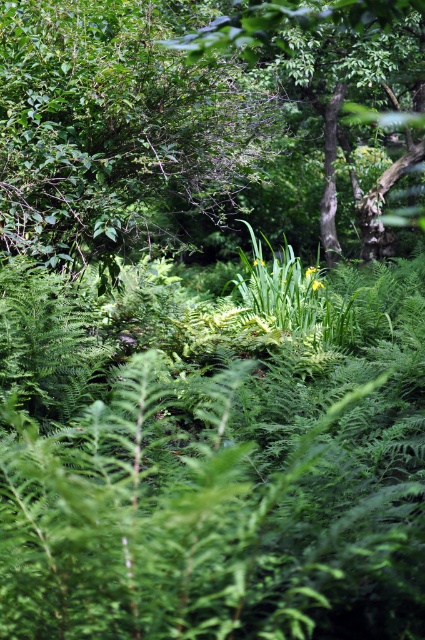
Describe the element at coordinates (119, 129) in the screenshot. I see `green leafy tree at upper center` at that location.

Measure the distance between green leafy tree at upper center and camera.

A distance of 4.98 meters exists between green leafy tree at upper center and camera.

Identify the location of green leafy tree at upper center. (119, 129).